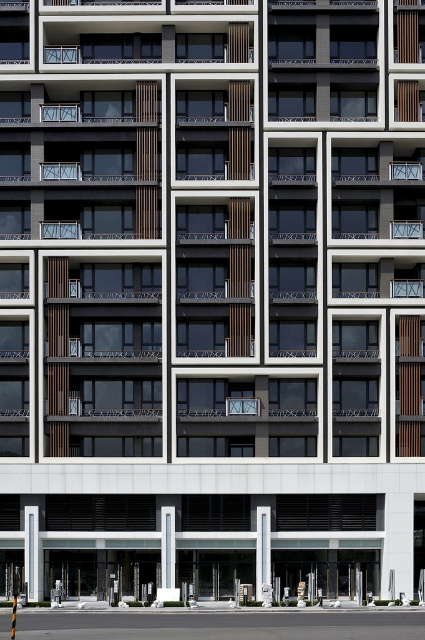
Is white concrete pillar at center below white glossy pillar at center?

Yes.

Between white concrete pillar at center and white glossy pillar at center, which one is positioned lower?

white concrete pillar at center is lower down.

Is point (258, 548) closer to viewer compared to point (172, 561)?

No, (258, 548) is further to viewer.

Where is `white concrete pillar at center`? white concrete pillar at center is located at coordinates (263, 548).